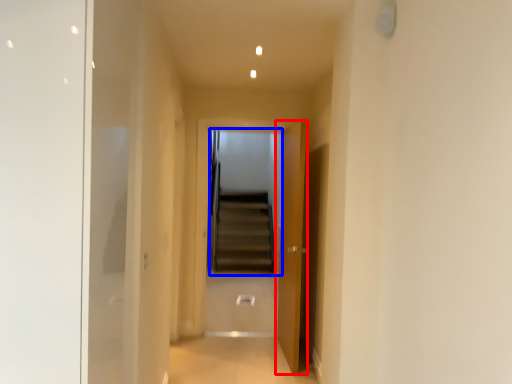
Question: Which object appears farthest to the camera in this image, door (highlighted by a red box) or escalator (highlighted by a blue box)?

Choices:
 (A) door
 (B) escalator

Answer: (B)